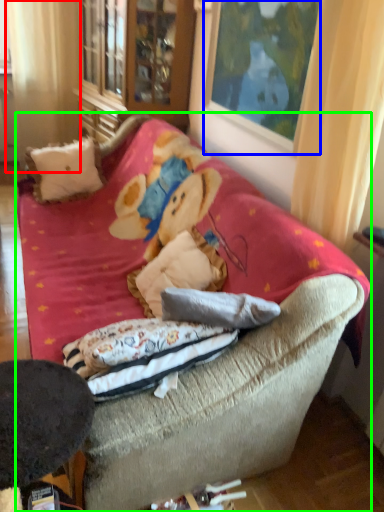
Question: Which is farther away from curtain (highlighted by a red box)? picture frame (highlighted by a blue box) or studio couch (highlighted by a green box)?

Choices:
 (A) picture frame
 (B) studio couch

Answer: (A)